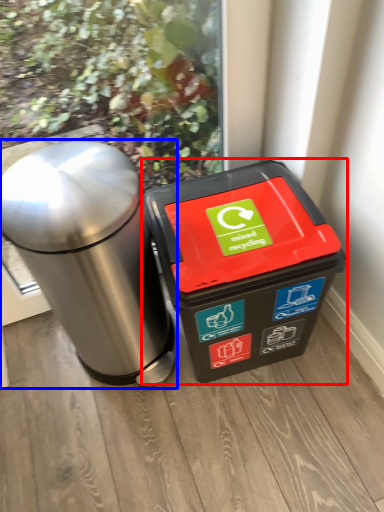
Question: Which object is closer to the camera taking this photo, waste container (highlighted by a red box) or waste container (highlighted by a blue box)?

Choices:
 (A) waste container
 (B) waste container

Answer: (B)